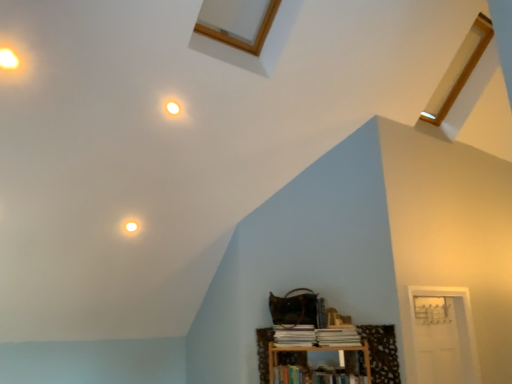
How much space does white paper book at lower center, the 2th book when ordered from bottom to top, occupy vertically?

white paper book at lower center, the 2th book when ordered from bottom to top, is 6.02 inches tall.

What do you see at coordinates (314, 376) in the screenshot?
I see `hardcover book at lower center, the third book in the top-to-bottom sequence` at bounding box center [314, 376].

In order to face wooden bookshelf at lower right, should I rotate leftwards or rightwards?

Turn right approximately 9.473 degrees to face it.

What are the coordinates of `white paper book at lower center, positioned as the 3th book in bottom-to-top order` in the screenshot? It's located at (338, 336).

Identify the location of white glossy light fixture at upper left, arranged as the 2th dot when viewed from the back. The height and width of the screenshot is (384, 512). (8, 59).

Where is `white paper book at lower center, the 2th book when ordered from bottom to top`? Image resolution: width=512 pixels, height=384 pixels. white paper book at lower center, the 2th book when ordered from bottom to top is located at coordinates (294, 335).

How different are the orientations of white paper book at lower center, the 2th book when ordered from bottom to top, and hardcover book at lower center, the first book ordered from the bottom, in degrees?

white paper book at lower center, the 2th book when ordered from bottom to top, and hardcover book at lower center, the first book ordered from the bottom, are facing 0.000632 degrees away from each other.

How much distance is there between white paper book at lower center, the 2th book when ordered from bottom to top, and hardcover book at lower center, the first book ordered from the bottom?

A distance of 8.97 inches exists between white paper book at lower center, the 2th book when ordered from bottom to top, and hardcover book at lower center, the first book ordered from the bottom.

Considering the relative sizes of white paper book at lower center, marked as the second book in a top-to-bottom arrangement, and hardcover book at lower center, the third book in the top-to-bottom sequence, in the image provided, is white paper book at lower center, marked as the second book in a top-to-bottom arrangement, shorter than hardcover book at lower center, the third book in the top-to-bottom sequence,?

Indeed, white paper book at lower center, marked as the second book in a top-to-bottom arrangement, has a lesser height compared to hardcover book at lower center, the third book in the top-to-bottom sequence.

Locate an element on the screen. The height and width of the screenshot is (384, 512). the 2nd book positioned above the hardcover book at lower center, the first book ordered from the bottom (from a real-world perspective) is located at coordinates (294, 335).

From a real-world perspective, which object rests below the other?

white paper book at lower center, the 2th book when ordered from bottom to top, from a real-world perspective.

From a real-world perspective, which book is the 1st one underneath the white glossy light at upper center? Please provide its 2D coordinates.

[(294, 335)]

Which is more to the right, white paper book at lower center, the 2th book when ordered from bottom to top, or white glossy light at upper center?

white paper book at lower center, the 2th book when ordered from bottom to top, is more to the right.

How distant is white paper book at lower center, marked as the second book in a top-to-bottom arrangement, from white glossy light at upper center?

A distance of 1.43 meters exists between white paper book at lower center, marked as the second book in a top-to-bottom arrangement, and white glossy light at upper center.

Which of these two, white glossy light at upper center or hardcover book at lower center, the third book in the top-to-bottom sequence, is wider?

hardcover book at lower center, the third book in the top-to-bottom sequence.

Can we say white glossy light at upper center lies outside hardcover book at lower center, the first book ordered from the bottom?

white glossy light at upper center is positioned outside hardcover book at lower center, the first book ordered from the bottom.

Which is more to the right, white glossy light at upper center or hardcover book at lower center, the first book ordered from the bottom?

From the viewer's perspective, hardcover book at lower center, the first book ordered from the bottom, appears more on the right side.

Who is taller, white glossy light at upper center or hardcover book at lower center, the first book ordered from the bottom?

Standing taller between the two is hardcover book at lower center, the first book ordered from the bottom.

From a real-world perspective, does white glossy light fixture at upper center, placed as the first dot when sorted from bottom to top, stand above hardcover book at lower center, the third book in the top-to-bottom sequence?

Yes, from a real-world perspective, white glossy light fixture at upper center, placed as the first dot when sorted from bottom to top, is over hardcover book at lower center, the third book in the top-to-bottom sequence

Is white glossy light fixture at upper center, placed as the first dot when sorted from bottom to top, at the right side of hardcover book at lower center, the first book ordered from the bottom?

Incorrect, white glossy light fixture at upper center, placed as the first dot when sorted from bottom to top, is not on the right side of hardcover book at lower center, the first book ordered from the bottom.

Between white glossy light fixture at upper center, arranged as the 2th dot when viewed from the left, and hardcover book at lower center, the first book ordered from the bottom, which one is positioned behind?

hardcover book at lower center, the first book ordered from the bottom, is more distant.

How different are the orientations of white glossy light fixture at upper center, acting as the 1th dot starting from the right, and hardcover book at lower center, the first book ordered from the bottom, in degrees?

The angle between the facing direction of white glossy light fixture at upper center, acting as the 1th dot starting from the right, and the facing direction of hardcover book at lower center, the first book ordered from the bottom, is 46.2 degrees.

In the scene shown: Is white paper book at lower center, marked as the second book in a top-to-bottom arrangement, smaller than white paper book at lower center, positioned as the 3th book in bottom-to-top order?

No, white paper book at lower center, marked as the second book in a top-to-bottom arrangement, is not smaller than white paper book at lower center, positioned as the 3th book in bottom-to-top order.

Is point (304, 336) in front of point (356, 336)?

No.

From the image's perspective, is white paper book at lower center, the 2th book when ordered from bottom to top, over white paper book at lower center, which is the 1th book from top to bottom?

No, from the image's perspective, white paper book at lower center, the 2th book when ordered from bottom to top, is not above white paper book at lower center, which is the 1th book from top to bottom.

Find the location of `book above the white paper book at lower center, positioned as the 3th book in bottom-to-top order (from a real-world perspective)`. book above the white paper book at lower center, positioned as the 3th book in bottom-to-top order (from a real-world perspective) is located at coordinates (294, 335).

Would you say white glossy light at upper center is a long distance from white paper book at lower center, marked as the second book in a top-to-bottom arrangement?

Absolutely, white glossy light at upper center is distant from white paper book at lower center, marked as the second book in a top-to-bottom arrangement.

From a real-world perspective, is white glossy light at upper center under white paper book at lower center, the 2th book when ordered from bottom to top?

No, from a real-world perspective, white glossy light at upper center is not under white paper book at lower center, the 2th book when ordered from bottom to top.

Locate an element on the screen. This screenshot has height=384, width=512. light above the white paper book at lower center, marked as the second book in a top-to-bottom arrangement (from a real-world perspective) is located at coordinates (131, 226).

Considering the relative sizes of white paper book at lower center, marked as the second book in a top-to-bottom arrangement, and white glossy light fixture at upper left, the 2th dot from the right, in the image provided, is white paper book at lower center, marked as the second book in a top-to-bottom arrangement, bigger than white glossy light fixture at upper left, the 2th dot from the right,?

Indeed, white paper book at lower center, marked as the second book in a top-to-bottom arrangement, has a larger size compared to white glossy light fixture at upper left, the 2th dot from the right.

From a real-world perspective, which is physically above, white paper book at lower center, the 2th book when ordered from bottom to top, or white glossy light fixture at upper left, arranged as the 2th dot when viewed from the back?

A: white glossy light fixture at upper left, arranged as the 2th dot when viewed from the back, from a real-world perspective.

From the image's perspective, is white paper book at lower center, marked as the second book in a top-to-bottom arrangement, located above white glossy light fixture at upper left, the 2th dot from the right?

Incorrect, from the image's perspective, white paper book at lower center, marked as the second book in a top-to-bottom arrangement, is lower than white glossy light fixture at upper left, the 2th dot from the right.

Is white paper book at lower center, the 2th book when ordered from bottom to top, closer to the viewer compared to white glossy light fixture at upper left, placed as the first dot when sorted from left to right?

No, white paper book at lower center, the 2th book when ordered from bottom to top, is further to the viewer.

You are a GUI agent. You are given a task and a screenshot of the screen. Output one action in this format:
    pyautogui.click(x=<x>, y=<y>)
    Task: Click on the 2nd book behind the hardcover book at lower center, the first book ordered from the bottom, counting from the anchor's position
    This screenshot has width=512, height=384.
    Given the screenshot: What is the action you would take?
    pyautogui.click(x=294, y=335)

Image resolution: width=512 pixels, height=384 pixels. What are the coordinates of `the 1st book counting from the right side of the white glossy light at upper center` in the screenshot? It's located at (294, 335).

Considering their positions, is white paper book at lower center, marked as the second book in a top-to-bottom arrangement, positioned further to hardcover book at lower center, the third book in the top-to-bottom sequence, than white paper book at lower center, which is the 1th book from top to bottom?

The object further to hardcover book at lower center, the third book in the top-to-bottom sequence, is white paper book at lower center, which is the 1th book from top to bottom.

Looking at this image, considering their positions, is white paper book at lower center, which is the 1th book from top to bottom, positioned closer to white glossy light fixture at upper left, arranged as the second dot when ordered from the bottom, than white glossy light at upper center?

white glossy light at upper center is closer to white glossy light fixture at upper left, arranged as the second dot when ordered from the bottom.

When comparing their distances from white glossy light fixture at upper center, the second dot viewed from the top, does white paper book at lower center, the 2th book when ordered from bottom to top, or hardcover book at lower center, the first book ordered from the bottom, seem further?

Among the two, hardcover book at lower center, the first book ordered from the bottom, is located further to white glossy light fixture at upper center, the second dot viewed from the top.

Which object lies further to the anchor point wooden bookshelf at lower right, white paper book at lower center, which is the 1th book from top to bottom, or white paper book at lower center, the 2th book when ordered from bottom to top?

white paper book at lower center, which is the 1th book from top to bottom, lies further to wooden bookshelf at lower right than the other object.

When comparing their distances from white glossy light fixture at upper left, arranged as the 2th dot when viewed from the back, does hardcover book at lower center, the third book in the top-to-bottom sequence, or white paper book at lower center, marked as the second book in a top-to-bottom arrangement, seem further?

hardcover book at lower center, the third book in the top-to-bottom sequence, lies further to white glossy light fixture at upper left, arranged as the 2th dot when viewed from the back, than the other object.

Consider the image. Which object lies nearer to the anchor point white glossy light fixture at upper left, arranged as the second dot when ordered from the bottom, white paper book at lower center, the 2th book when ordered from bottom to top, or white paper book at lower center, which is the 1th book from top to bottom?

white paper book at lower center, the 2th book when ordered from bottom to top, is closer to white glossy light fixture at upper left, arranged as the second dot when ordered from the bottom.

From the image, which object appears to be nearer to wooden bookshelf at lower right, white paper book at lower center, the 2th book when ordered from bottom to top, or hardcover book at lower center, the third book in the top-to-bottom sequence?

white paper book at lower center, the 2th book when ordered from bottom to top, lies closer to wooden bookshelf at lower right than the other object.

Based on their spatial positions, is wooden bookshelf at lower right or hardcover book at lower center, the first book ordered from the bottom, closer to white glossy light fixture at upper left, placed as the first dot when sorted from left to right?

wooden bookshelf at lower right is closer to white glossy light fixture at upper left, placed as the first dot when sorted from left to right.

Locate an element on the screen. The height and width of the screenshot is (384, 512). light between white glossy light fixture at upper center, which ranks as the second dot in front-to-back order, and white paper book at lower center, marked as the second book in a top-to-bottom arrangement, in the vertical direction is located at coordinates (131, 226).

Identify the location of dot between white glossy light fixture at upper left, the 2th dot from the right, and hardcover book at lower center, the third book in the top-to-bottom sequence, in the vertical direction. (173, 107).

Find the location of a particular element. The height and width of the screenshot is (384, 512). light between white glossy light fixture at upper center, which appears as the first dot when viewed from the back, and hardcover book at lower center, the first book ordered from the bottom, in the vertical direction is located at coordinates (131, 226).

This screenshot has height=384, width=512. I want to click on bookcase between white glossy light fixture at upper left, arranged as the 1th dot when viewed from the top, and hardcover book at lower center, the third book in the top-to-bottom sequence, in the vertical direction, so [308, 346].